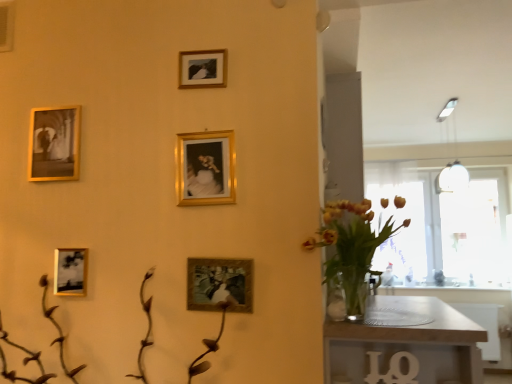
Question: Should I look upward or downward to see gold-framed photo at upper left, acting as the 2th picture frame starting from the top?

Choices:
 (A) down
 (B) up

Answer: (B)

Question: From a real-world perspective, is translucent glass vase at right positioned under wooden table at lower right based on gravity?

Choices:
 (A) yes
 (B) no

Answer: (B)

Question: Is translucent glass vase at right to the right of wooden table at lower right from the viewer's perspective?

Choices:
 (A) yes
 (B) no

Answer: (B)

Question: Is translucent glass vase at right directly adjacent to wooden table at lower right?

Choices:
 (A) no
 (B) yes

Answer: (A)

Question: Does translucent glass vase at right have a greater width compared to wooden table at lower right?

Choices:
 (A) yes
 (B) no

Answer: (B)

Question: Is translucent glass vase at right closer to the viewer compared to wooden table at lower right?

Choices:
 (A) no
 (B) yes

Answer: (A)

Question: Is the depth of translucent glass vase at right greater than that of wooden table at lower right?

Choices:
 (A) yes
 (B) no

Answer: (A)

Question: Does gold-framed picture at upper center, the 5th picture frame ordered from the bottom, appear on the left side of matte gold picture frame at center, the 5th picture frame positioned from the top?

Choices:
 (A) yes
 (B) no

Answer: (A)

Question: Is gold-framed picture at upper center, marked as the 3th picture frame in a left-to-right arrangement, at the right side of matte gold picture frame at center, which is counted as the 1th picture frame, starting from the bottom?

Choices:
 (A) no
 (B) yes

Answer: (A)

Question: From the image's perspective, does gold-framed picture at upper center, which ranks as the 3th picture frame in right-to-left order, appear higher than matte gold picture frame at center, which is counted as the 1th picture frame, starting from the bottom?

Choices:
 (A) yes
 (B) no

Answer: (A)

Question: Is gold-framed picture at upper center, marked as the 3th picture frame in a left-to-right arrangement, far away from matte gold picture frame at center, which is counted as the 1th picture frame, starting from the bottom?

Choices:
 (A) no
 (B) yes

Answer: (A)

Question: Can you confirm if gold-framed picture at upper center, the 5th picture frame ordered from the bottom, is thinner than matte gold picture frame at center, which is the fifth picture frame from left to right?

Choices:
 (A) yes
 (B) no

Answer: (B)

Question: Does gold-framed picture at upper center, marked as the 3th picture frame in a left-to-right arrangement, have a greater height compared to matte gold picture frame at center, the first picture frame viewed from the right?

Choices:
 (A) yes
 (B) no

Answer: (B)

Question: Can matte gold picture frame at lower left, the 4th picture frame when ordered from right to left, be found inside gold metallic picture frame at center, which appears as the 3th picture frame when viewed from the top?

Choices:
 (A) yes
 (B) no

Answer: (B)